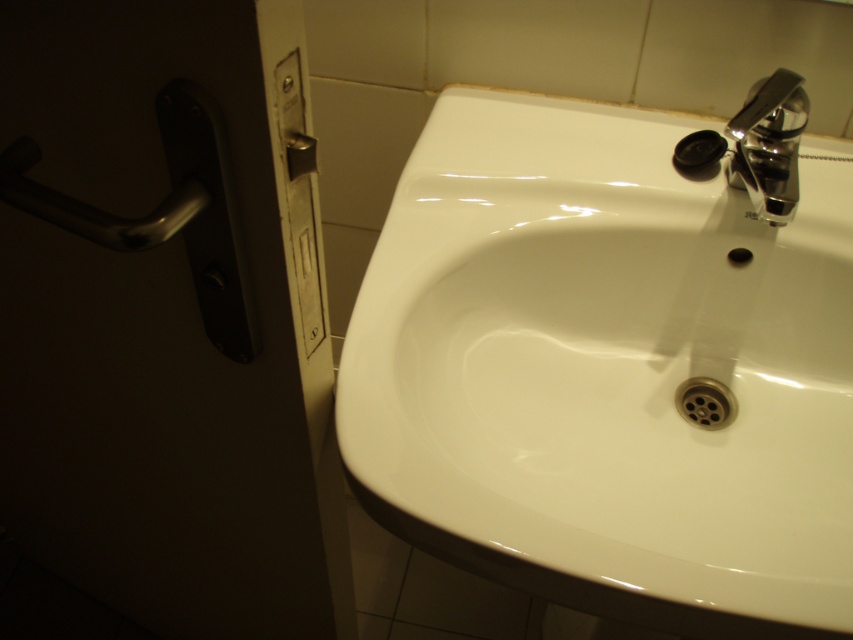
Question: Which object appears closest to the camera in this image?

Choices:
 (A) polished chrome faucet at upper right
 (B) white glossy sink at center

Answer: (B)

Question: Which point is closer to the camera taking this photo?

Choices:
 (A) (781, 161)
 (B) (189, 113)

Answer: (B)

Question: Does white glossy sink at center have a smaller size compared to polished chrome faucet at upper right?

Choices:
 (A) yes
 (B) no

Answer: (B)

Question: Estimate the real-world distances between objects in this image. Which object is closer to the polished metal door handle at left?

Choices:
 (A) polished chrome faucet at upper right
 (B) white glossy sink at center

Answer: (B)

Question: Is polished metal door handle at left to the right of polished chrome faucet at upper right from the viewer's perspective?

Choices:
 (A) yes
 (B) no

Answer: (B)

Question: Can you confirm if polished metal door handle at left is wider than polished chrome faucet at upper right?

Choices:
 (A) no
 (B) yes

Answer: (B)